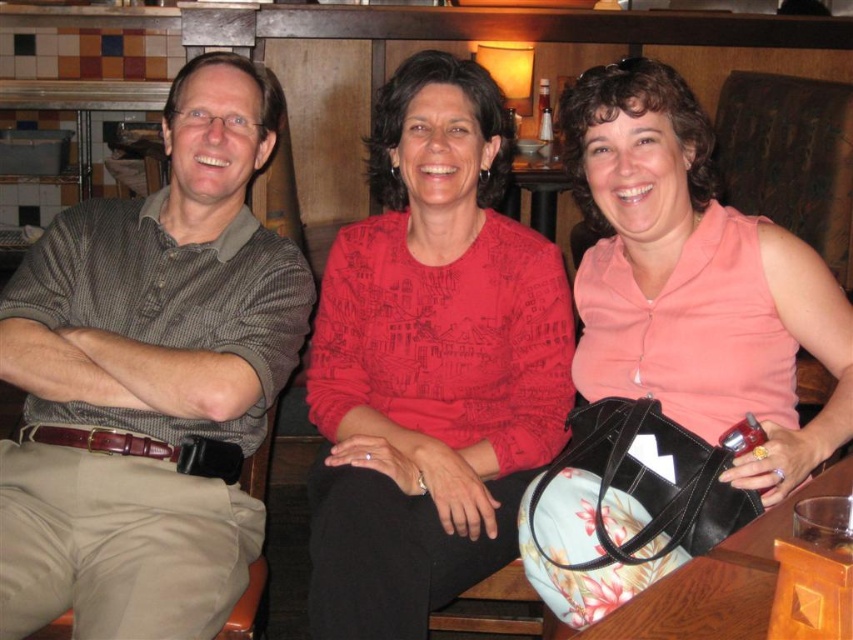
Question: Which object is farther from the camera taking this photo?

Choices:
 (A) matte red sweater at center
 (B) pink fabric purse at center

Answer: (A)

Question: Which point is closer to the camera taking this photo?

Choices:
 (A) (548, 212)
 (B) (646, 340)
 (C) (650, 634)
 (D) (560, 340)

Answer: (C)

Question: Does pink fabric purse at center have a larger size compared to wooden table at center?

Choices:
 (A) no
 (B) yes

Answer: (B)

Question: Does matte brown shirt at left have a lesser width compared to matte red sweater at center?

Choices:
 (A) yes
 (B) no

Answer: (B)

Question: Does pink fabric purse at center have a lesser width compared to wooden table at lower right?

Choices:
 (A) yes
 (B) no

Answer: (B)

Question: Which point is closer to the camera?

Choices:
 (A) wooden table at center
 (B) matte brown shirt at left
 (C) wooden table at lower right

Answer: (C)